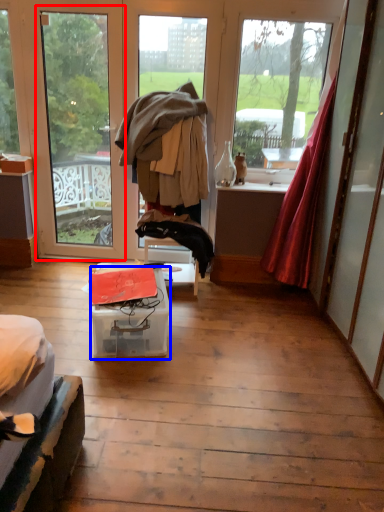
Question: Which point is closer to the camera, window (highlighted by a red box) or box (highlighted by a blue box)?

Choices:
 (A) window
 (B) box

Answer: (B)